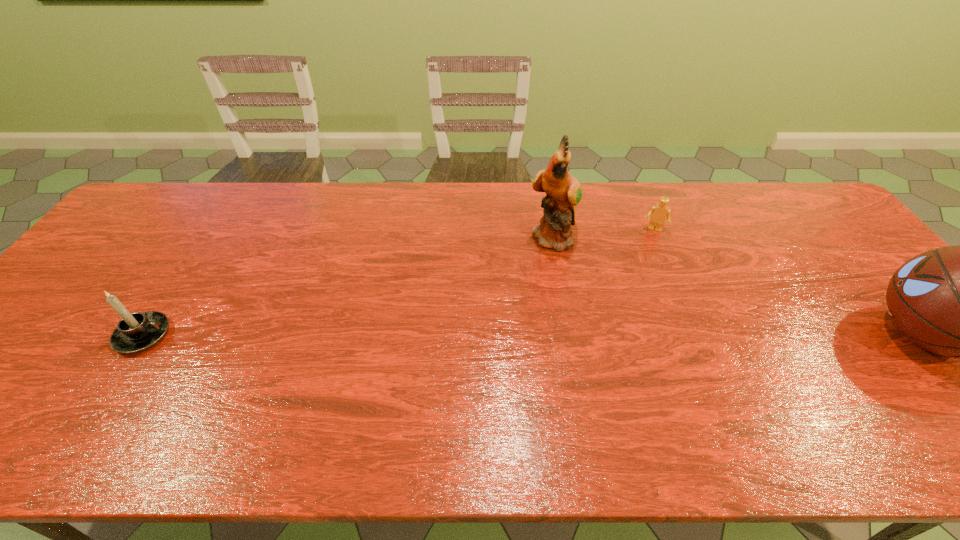
Where is `candle holder`? candle holder is located at coordinates (135, 332).

This screenshot has width=960, height=540. I want to click on the second shortest object, so click(x=135, y=332).

Where is `the third object from right to left`? the third object from right to left is located at coordinates (563, 192).

Where is `parrot`? This screenshot has width=960, height=540. parrot is located at coordinates (563, 192).

Locate an element on the screen. The height and width of the screenshot is (540, 960). Lego is located at coordinates (658, 213).

At what (x,y) coordinates should I click in order to perform the action: click on the second object from right to left. Please return your answer as a coordinate pair (x, y). Image resolution: width=960 pixels, height=540 pixels. Looking at the image, I should click on (658, 213).

Locate an element on the screen. vacant space located 0.400m with a handle on the side of the candle holder is located at coordinates (x=332, y=335).

Identify the location of free region located on the front-facing side of the parrot. (576, 267).

This screenshot has width=960, height=540. Identify the location of free region located 0.140m on the front-facing side of the parrot. (592, 286).

The height and width of the screenshot is (540, 960). I want to click on vacant position located on the front-facing side of the parrot, so click(618, 318).